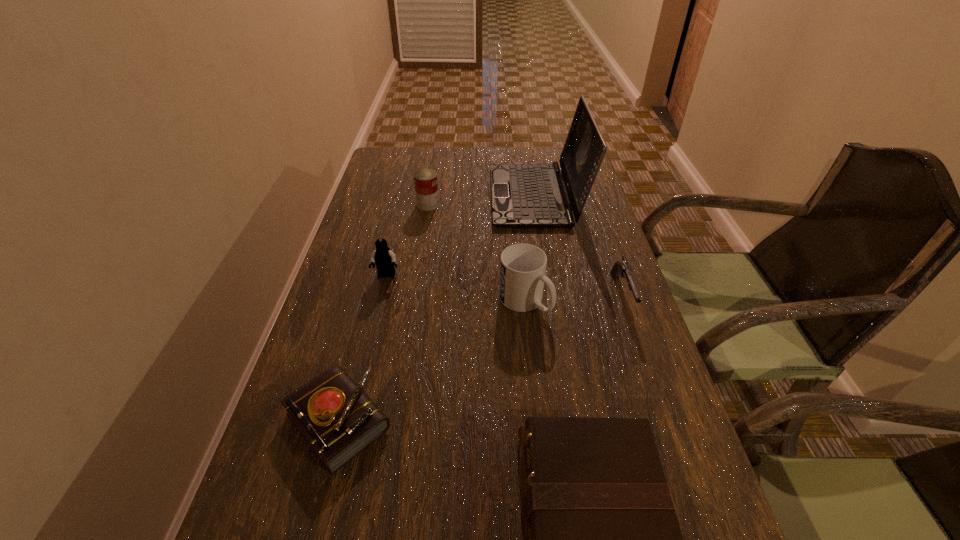
I want to click on laptop computer, so click(x=524, y=195).

This screenshot has width=960, height=540. Find the location of `mug`. mug is located at coordinates (523, 266).

Find the location of `Lego`. Lego is located at coordinates pos(384,258).

I want to click on can, so click(x=426, y=185).

The height and width of the screenshot is (540, 960). What are the coordinates of `gun` in the screenshot? It's located at (622, 267).

The width and height of the screenshot is (960, 540). I want to click on the shortest object, so click(335, 416).

In order to click on vacant area situated 0.400m on the screen of the laptop computer in this screenshot , I will do `click(366, 195)`.

Identify the location of free point located on the screen of the laptop computer. (447, 195).

Where is `vacant space located on the screen of the laptop computer`? This screenshot has height=540, width=960. vacant space located on the screen of the laptop computer is located at coordinates (442, 195).

I want to click on vacant space located 0.160m on the front of the mug, so click(x=534, y=382).